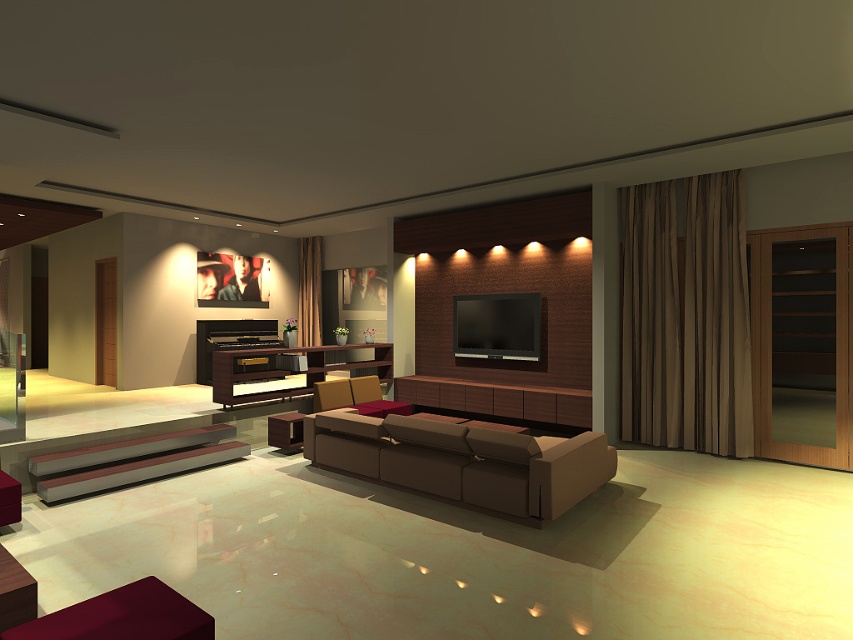
From the picture: Is metallic gray bench at lower left shorter than velvet red ottoman at lower left?

No, metallic gray bench at lower left is not shorter than velvet red ottoman at lower left.

From the picture: Can you confirm if metallic gray bench at lower left is thinner than velvet red ottoman at lower left?

Incorrect, metallic gray bench at lower left's width is not less than velvet red ottoman at lower left's.

Describe the element at coordinates (131, 461) in the screenshot. I see `metallic gray bench at lower left` at that location.

This screenshot has height=640, width=853. In order to click on metallic gray bench at lower left in this screenshot , I will do `click(131, 461)`.

Between point (287, 428) and point (12, 515), which one is positioned in front?

Point (12, 515)

Find the location of a particular element. brown leather cabinet at center is located at coordinates (285, 429).

This screenshot has height=640, width=853. Identify the location of brown leather cabinet at center. (285, 429).

Between point (96, 461) and point (107, 602), which one is positioned in front?

Point (107, 602) is more forward.

Locate an element on the screen. Image resolution: width=853 pixels, height=640 pixels. metallic gray bench at lower left is located at coordinates (131, 461).